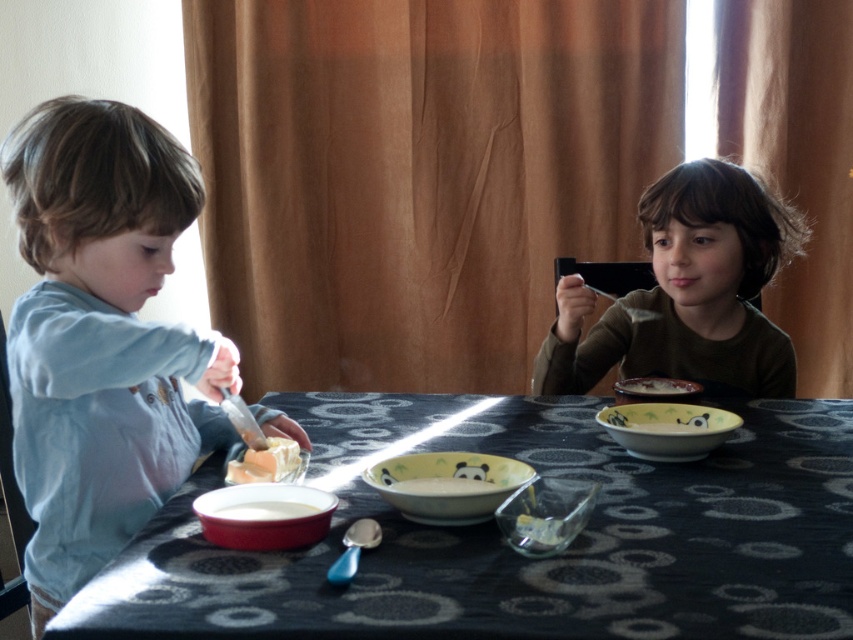
Is matte ceramic bowl at lower left shorter than smooth orange cheese at center?

In fact, matte ceramic bowl at lower left may be taller than smooth orange cheese at center.

Is matte ceramic bowl at lower left to the left of smooth orange cheese at center from the viewer's perspective?

In fact, matte ceramic bowl at lower left is to the right of smooth orange cheese at center.

Which is in front, point (334, 502) or point (287, 456)?

Point (334, 502) is more forward.

I want to click on matte ceramic bowl at lower left, so click(264, 515).

Does matte green shirt at upper right have a greater height compared to matte ceramic bowl at center?

Yes, matte green shirt at upper right is taller than matte ceramic bowl at center.

Which is above, matte green shirt at upper right or matte ceramic bowl at center?

matte green shirt at upper right is higher up.

Identify the location of matte green shirt at upper right. The height and width of the screenshot is (640, 853). (688, 292).

You are a GUI agent. You are given a task and a screenshot of the screen. Output one action in this format:
    pyautogui.click(x=<x>, y=<y>)
    Task: Click on the matte green shirt at upper right
    
    Given the screenshot: What is the action you would take?
    pyautogui.click(x=688, y=292)

Is matte green bowl at center wider than matte ceramic bowl at center?

Indeed, matte green bowl at center has a greater width compared to matte ceramic bowl at center.

Between matte green bowl at center and matte ceramic bowl at center, which one has more height?

matte ceramic bowl at center is taller.

Is point (434, 506) positioned before point (610, 436)?

That is True.

You are a GUI agent. You are given a task and a screenshot of the screen. Output one action in this format:
    pyautogui.click(x=<x>, y=<y>)
    Task: Click on the matte green bowl at center
    
    Given the screenshot: What is the action you would take?
    pyautogui.click(x=445, y=486)